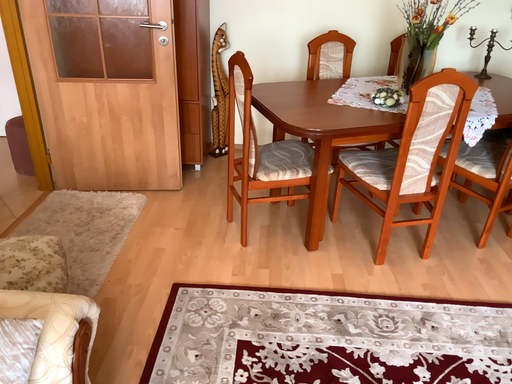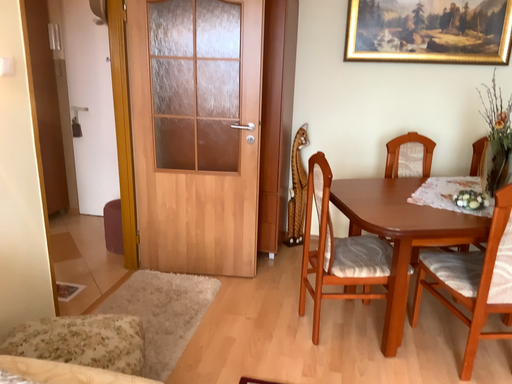
Question: How did the camera likely rotate when shooting the video?

Choices:
 (A) rotated right
 (B) rotated left

Answer: (B)